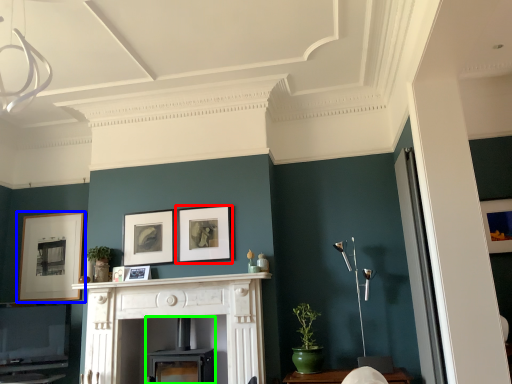
Question: Considering the real-world distances, which object is farthest from picture frame (highlighted by a red box)? picture frame (highlighted by a blue box) or fireplace (highlighted by a green box)?

Choices:
 (A) picture frame
 (B) fireplace

Answer: (A)